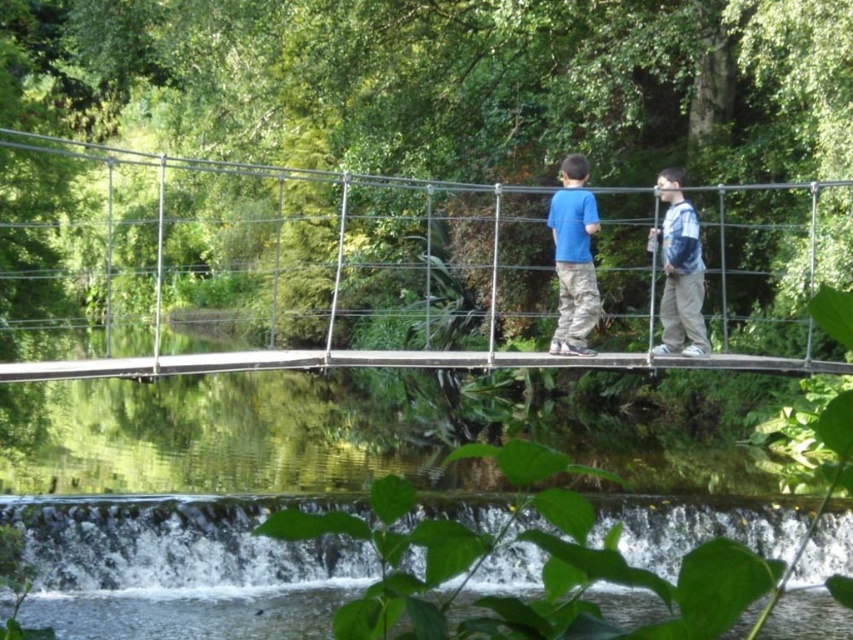
You are standing on the metallic wire suspension bridge at center and want to look down at the water below. Can you see the matte blue shirt at center from your current position?

The metallic wire suspension bridge at center is taller than matte blue shirt at center, so yes, you can see the matte blue shirt at center from your current position on the bridge.

You are standing on the metallic wire suspension bridge at center. What are the coordinates of the bridge?

The coordinates of the metallic wire suspension bridge at center are at point (390,266).

You are standing at point A located at point (x=230, y=216). You want to walk to point B which is 139.94 feet away. Is there a path available between you and point B that allows you to walk directly without needing to go around any obstacles?

Yes, there is a direct path available between point A at point (x=230, y=216) and point B since the suspension bridge spans over the calm body of water, providing a clear pathway without obstacles.